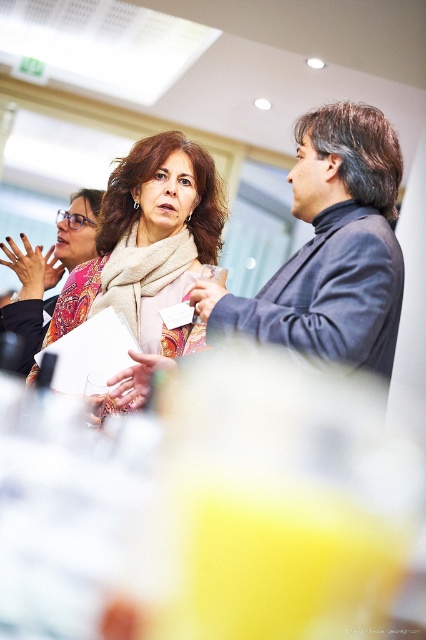
The image size is (426, 640). Describe the element at coordinates (334, 246) in the screenshot. I see `dark blue sweater at center` at that location.

In the scene shown: Which is more to the right, dark blue sweater at center or matte pink scarf at center?

Positioned to the right is dark blue sweater at center.

What do you see at coordinates (334, 246) in the screenshot? This screenshot has width=426, height=640. I see `dark blue sweater at center` at bounding box center [334, 246].

You are a GUI agent. You are given a task and a screenshot of the screen. Output one action in this format:
    pyautogui.click(x=<x>, y=<y>)
    Task: Click on the dark blue sweater at center
    
    Given the screenshot: What is the action you would take?
    pyautogui.click(x=334, y=246)

Which is behind, point (227, 321) or point (166, 282)?

The point (166, 282) is behind.

The image size is (426, 640). In order to click on dark blue sweater at center in this screenshot , I will do `click(334, 246)`.

The height and width of the screenshot is (640, 426). Find the location of `dark blue sweater at center`. dark blue sweater at center is located at coordinates (334, 246).

Between matte beige scarf at center and matte plastic cup at center, which one has more height?

With more height is matte beige scarf at center.

Describe the element at coordinates (149, 243) in the screenshot. This screenshot has width=426, height=640. I see `matte beige scarf at center` at that location.

Which is in front, point (137, 289) or point (207, 308)?

Point (207, 308) is more forward.

In order to click on matte beige scarf at center in this screenshot , I will do `click(149, 243)`.